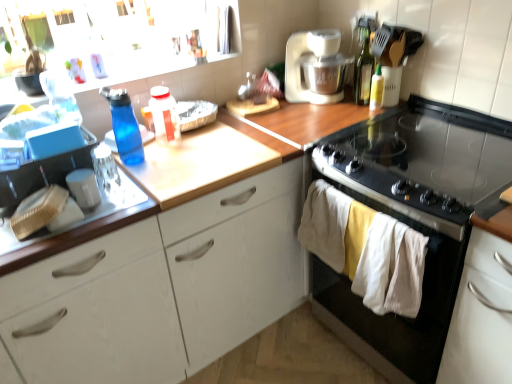
Identify the location of vacant area that lies to the right of translucent plastic bottle at center, the 2th bottle positioned from the left. (217, 139).